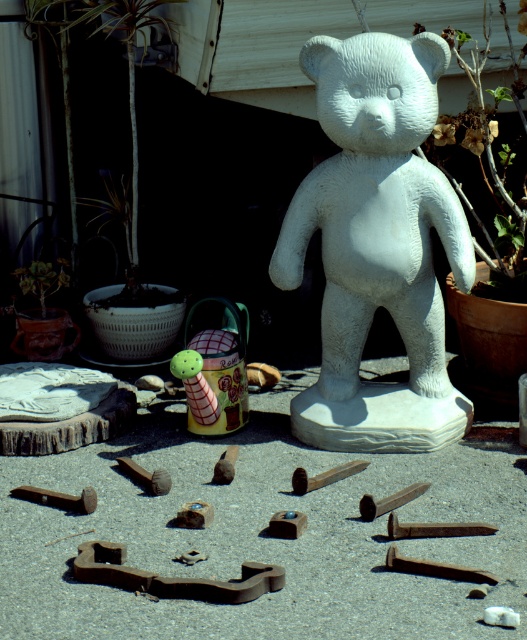
You are a gardener who wants to place a new decorative item between the white stone bear at center and the green rubber toy at center. Based on their positions, which object should you move closer to the front to create space?

The white stone bear at center is in front of the green rubber toy at center. To create space between them, you should move the green rubber toy at center closer to the front so it is positioned in front of the white stone bear at center.

You are a gardener who wants to retrieve the green rubber toy at center from under the white stone bear at center. Is the bear currently blocking access to the toy?

The white stone bear at center is positioned over green rubber toy at center, so yes, the bear is blocking access to the toy.